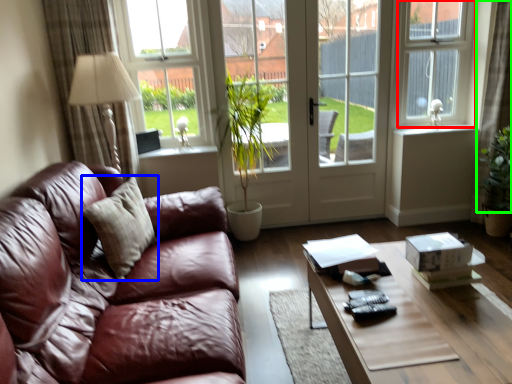
Question: Estimate the real-world distances between objects in this image. Which object is closer to window frame (highlighted by a red box), pillow (highlighted by a blue box) or curtain (highlighted by a green box)?

Choices:
 (A) pillow
 (B) curtain

Answer: (B)